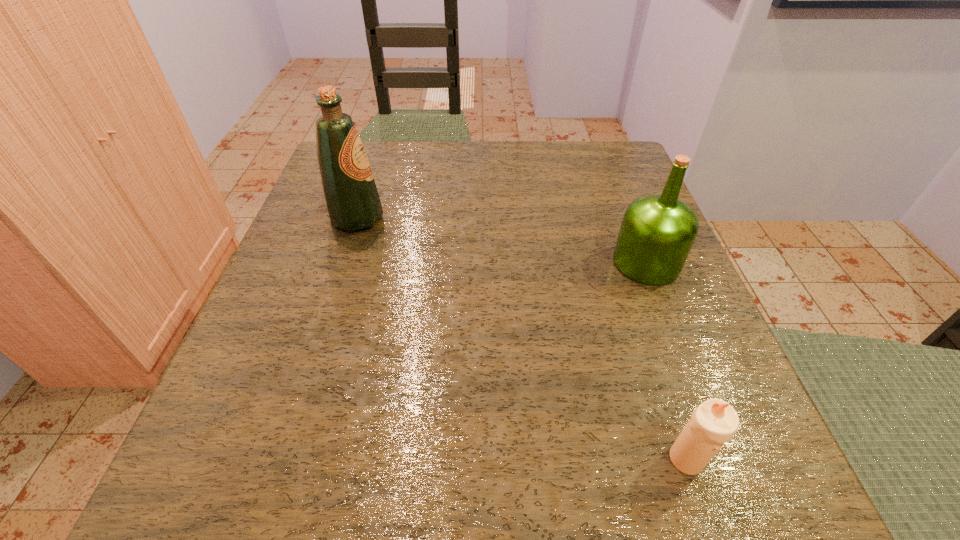
Find the location of a particular element. This screenshot has width=960, height=540. free space that satisfies the following two spatial constraints: 1. on the front-facing side of the second nearest object; 2. on the left side of the farther olive oil is located at coordinates (343, 262).